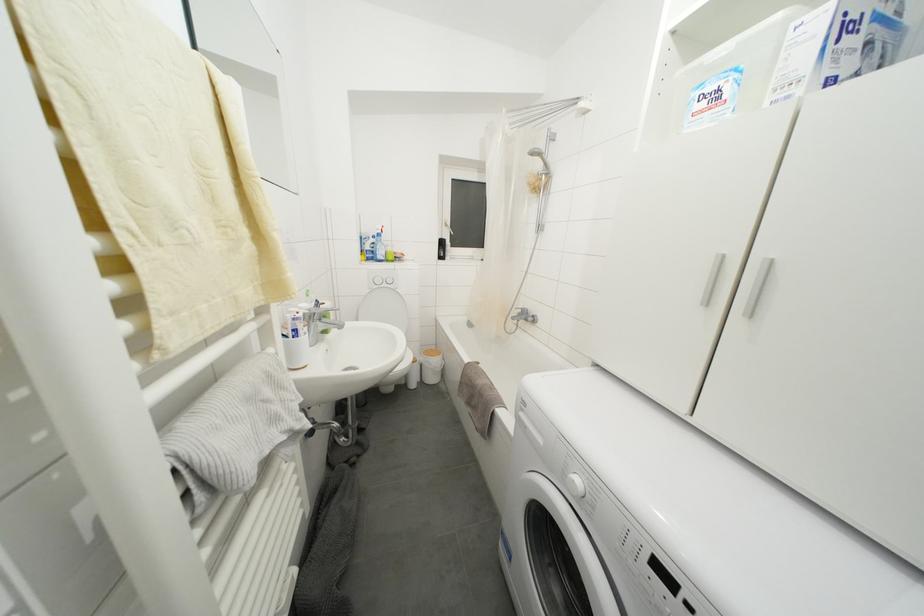
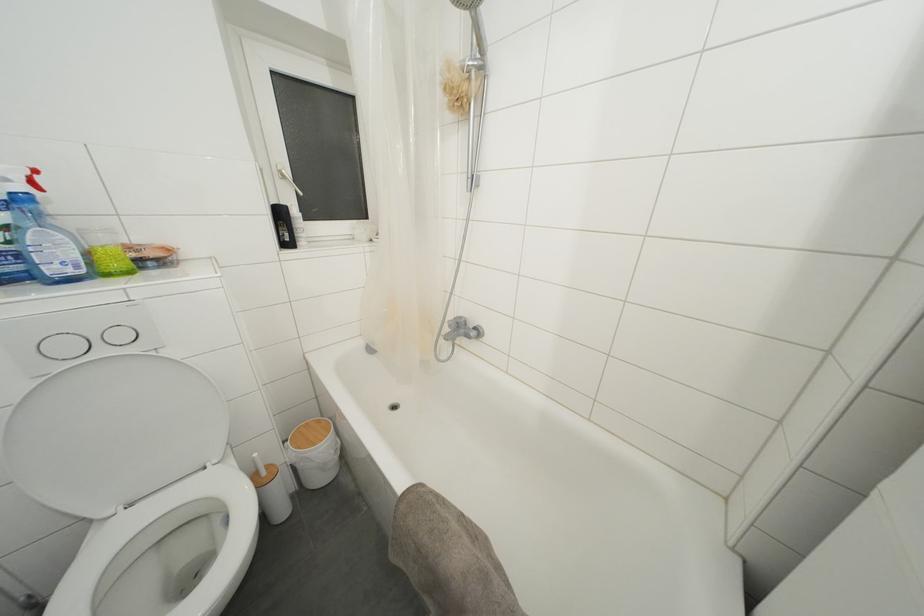
Where in the second image is the point corresponding to pixel 393 254 from the first image?

(108, 245)